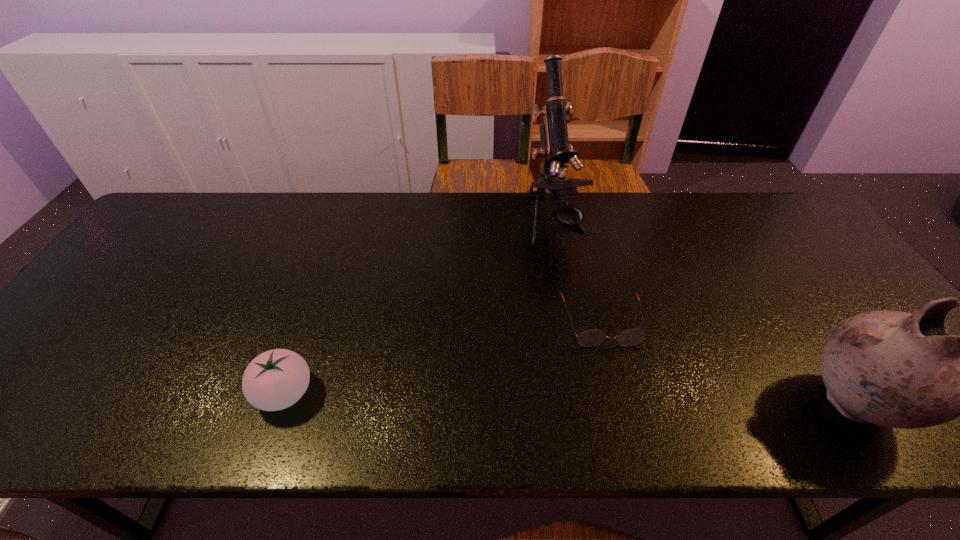
I want to click on free region located through the eyepiece of the microscope, so click(x=574, y=271).

Locate an element on the screen. The width and height of the screenshot is (960, 540). vacant area located through the eyepiece of the microscope is located at coordinates (583, 288).

Find the location of a particular element. free space located 0.140m through the eyepiece of the microscope is located at coordinates (585, 291).

Identify the location of object situated at the far edge. (555, 151).

This screenshot has height=540, width=960. Identify the location of tomato that is at the near edge. (276, 379).

Find the location of a particular element. The height and width of the screenshot is (540, 960). pottery located at the near edge is located at coordinates (894, 369).

The height and width of the screenshot is (540, 960). What are the coordinates of `object at the right edge` in the screenshot? It's located at (894, 369).

The width and height of the screenshot is (960, 540). Identify the location of object situated at the near right corner. (894, 369).

The height and width of the screenshot is (540, 960). What are the coordinates of `vacant space at the far edge of the desktop` in the screenshot? It's located at (405, 231).

Locate an element on the screen. The image size is (960, 540). free space at the near edge of the desktop is located at coordinates (403, 393).